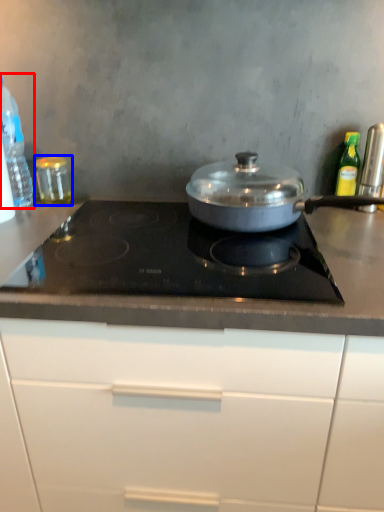
Question: Among these objects, which one is nearest to the camera, kitchen appliance (highlighted by a red box) or kitchen appliance (highlighted by a blue box)?

Choices:
 (A) kitchen appliance
 (B) kitchen appliance

Answer: (A)